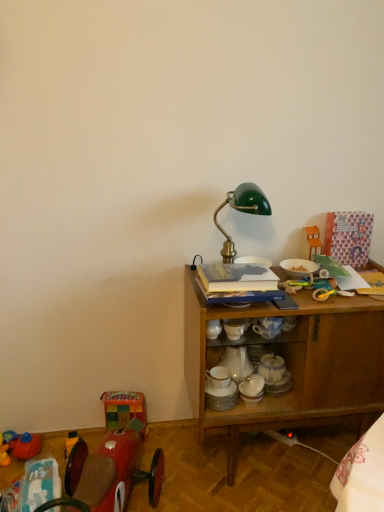
Question: From the image's perspective, is shiny red car at lower left, which ranks as the second toy in left-to-right order, on top of green glass table lamp at center?

Choices:
 (A) yes
 (B) no

Answer: (B)

Question: Considering the relative sizes of shiny red car at lower left, which is the second toy in bottom-to-top order, and green glass table lamp at center in the image provided, is shiny red car at lower left, which is the second toy in bottom-to-top order, smaller than green glass table lamp at center?

Choices:
 (A) yes
 (B) no

Answer: (B)

Question: Is shiny red car at lower left, which ranks as the second toy in left-to-right order, facing away from green glass table lamp at center?

Choices:
 (A) yes
 (B) no

Answer: (B)

Question: Does shiny red car at lower left, which is counted as the 3th toy, starting from the top, have a greater width compared to green glass table lamp at center?

Choices:
 (A) yes
 (B) no

Answer: (A)

Question: From a real-world perspective, does shiny red car at lower left, which is counted as the 3th toy, starting from the top, sit lower than green glass table lamp at center?

Choices:
 (A) no
 (B) yes

Answer: (B)

Question: From the image's perspective, is orange plastic toy house at upper right, marked as the first toy in a right-to-left arrangement, positioned above or below multicolored fabric cube at lower left, the second toy when ordered from top to bottom?

Choices:
 (A) below
 (B) above

Answer: (B)

Question: Does point (306, 231) appear closer or farther from the camera than point (117, 420)?

Choices:
 (A) farther
 (B) closer

Answer: (B)

Question: Relative to multicolored fabric cube at lower left, the 3th toy from the bottom, is orange plastic toy house at upper right, the 4th toy from the left, in front or behind?

Choices:
 (A) behind
 (B) front

Answer: (B)

Question: In the image, is orange plastic toy house at upper right, marked as the first toy in a right-to-left arrangement, on the left side or the right side of multicolored fabric cube at lower left, the second toy when ordered from top to bottom?

Choices:
 (A) right
 (B) left

Answer: (A)

Question: In terms of height, does wooden cabinet at right look taller or shorter compared to rubber duck at lower left, which appears as the first toy when ordered from the bottom?

Choices:
 (A) short
 (B) tall

Answer: (B)

Question: Is wooden cabinet at right spatially inside rubber duck at lower left, the fourth toy positioned from the top, or outside of it?

Choices:
 (A) outside
 (B) inside

Answer: (A)

Question: From a real-world perspective, relative to rubber duck at lower left, which appears as the first toy when ordered from the bottom, is wooden cabinet at right vertically above or below?

Choices:
 (A) below
 (B) above

Answer: (B)

Question: Is wooden cabinet at right bigger or smaller than rubber duck at lower left, the fourth toy positioned from the top?

Choices:
 (A) small
 (B) big

Answer: (B)

Question: Based on their positions, is green glass table lamp at center located to the left or right of wooden cabinet at right?

Choices:
 (A) left
 (B) right

Answer: (A)

Question: From their relative heights in the image, would you say green glass table lamp at center is taller or shorter than wooden cabinet at right?

Choices:
 (A) short
 (B) tall

Answer: (A)